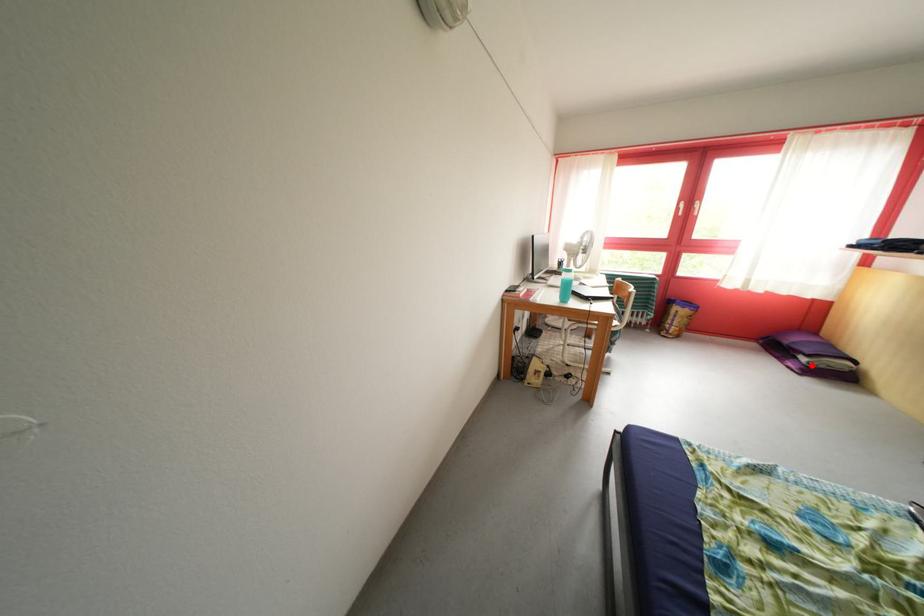
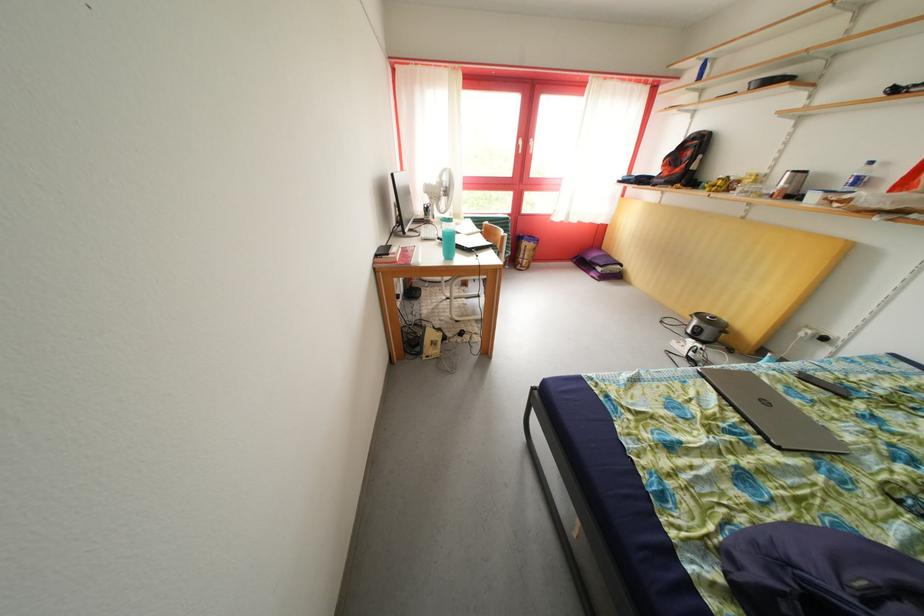
Question: I am providing you with two images of the same scene from different viewpoints. In image1, a red point is highlighted. Considering the same 3D point in image2, which of the following is correct?

Choices:
 (A) It is closer
 (B) It is farther

Answer: (A)